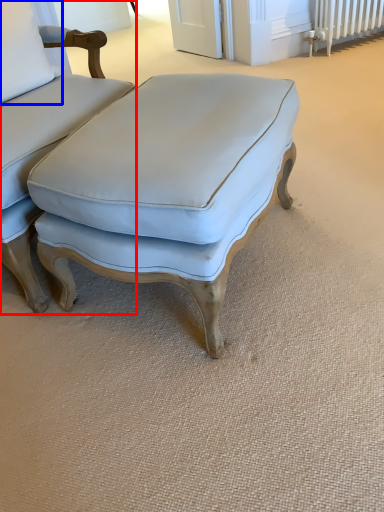
Question: Among these objects, which one is nearest to the camera, chair (highlighted by a red box) or pillow (highlighted by a blue box)?

Choices:
 (A) chair
 (B) pillow

Answer: (A)